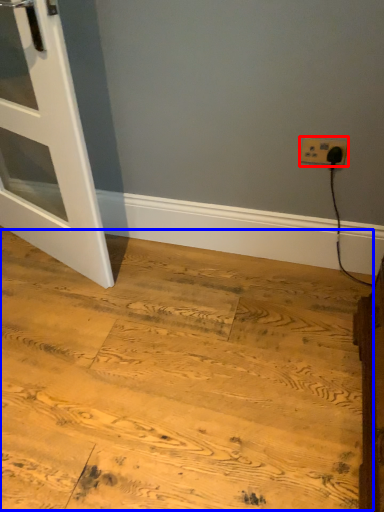
Question: Which of the following is the farthest to the observer, power plugs and sockets (highlighted by a red box) or plywood (highlighted by a blue box)?

Choices:
 (A) power plugs and sockets
 (B) plywood

Answer: (A)